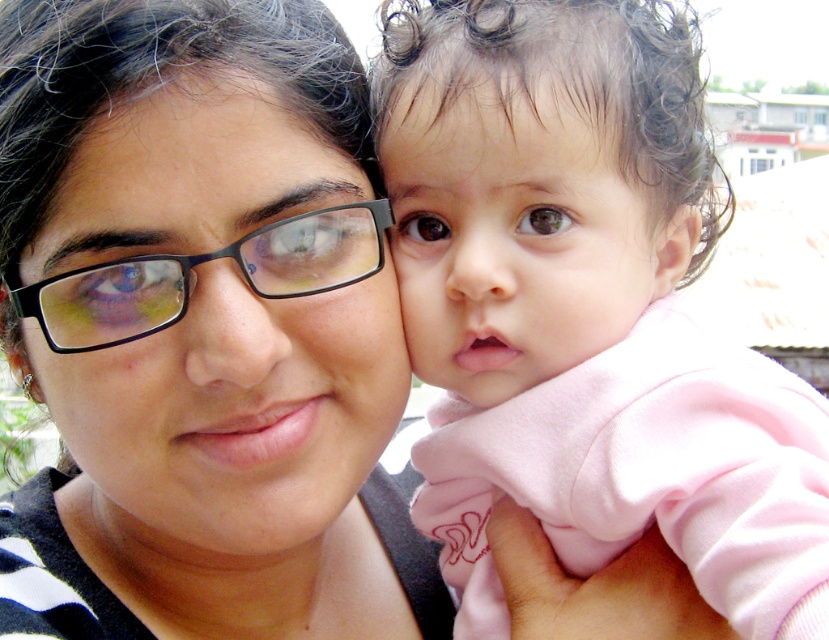
In the image, there is a point labeled at coordinates (x=585, y=310). Based on the scene description, what object does this point most likely represent?

The point at coordinates (x=585, y=310) corresponds to the pink soft fabric at center, which is part of the baby s light pink outfit with a small heart design near the neckline.

You are a photographer trying to focus on the pink soft fabric at center and the matte black glasses at center in the image. Which object should you adjust your camera focus on first if you want to ensure both are in focus?

The pink soft fabric at center is closer to the viewer than the matte black glasses at center. To ensure both are in focus, you should focus on the matte black glasses at center first since it is farther away, allowing the depth of field to cover the closer object.